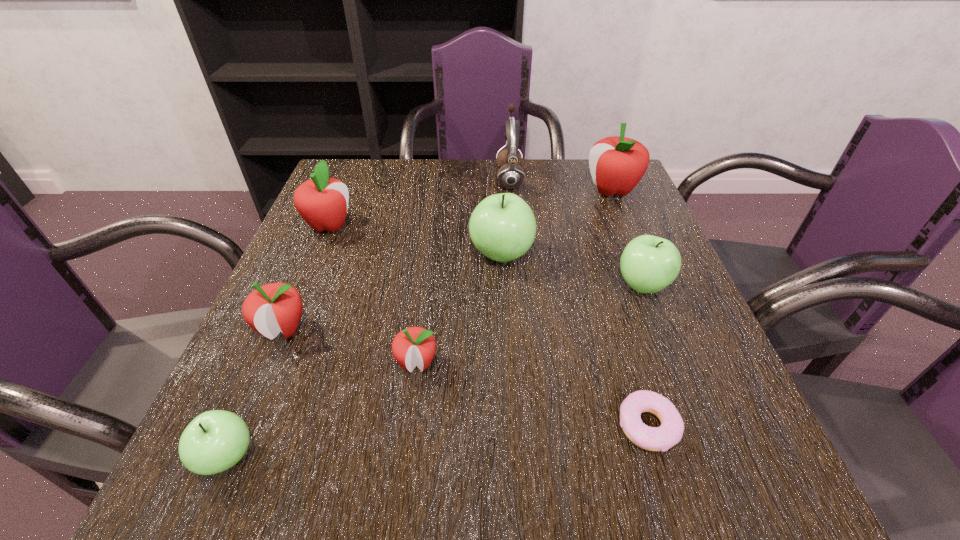
At what (x,y) coordinates should I click in order to perform the action: click on earphone. Please return your answer as a coordinate pair (x, y). Image resolution: width=960 pixels, height=540 pixels. Looking at the image, I should click on (510, 175).

Identify the location of the biggest red apple. (617, 164).

You are a GUI agent. You are given a task and a screenshot of the screen. Output one action in this format:
    pyautogui.click(x=<x>, y=<y>)
    Task: Click on the tallest apple
    This screenshot has height=540, width=960.
    Given the screenshot: What is the action you would take?
    pyautogui.click(x=617, y=164)

You are a GUI agent. You are given a task and a screenshot of the screen. Output one action in this format:
    pyautogui.click(x=<x>, y=<y>)
    Task: Click on the third smallest red apple
    
    Given the screenshot: What is the action you would take?
    pyautogui.click(x=322, y=201)

Identify the location of the second green apple from right to left. (502, 227).

Image resolution: width=960 pixels, height=540 pixels. I want to click on the biggest green apple, so (502, 227).

Where is `the rightmost green apple`? Image resolution: width=960 pixels, height=540 pixels. the rightmost green apple is located at coordinates (648, 264).

This screenshot has height=540, width=960. Identify the location of the second smallest red apple. (270, 309).

Find the location of a particular element. The image size is (960, 540). the smallest red apple is located at coordinates (414, 346).

This screenshot has height=540, width=960. I want to click on the third red apple from left to right, so click(414, 346).